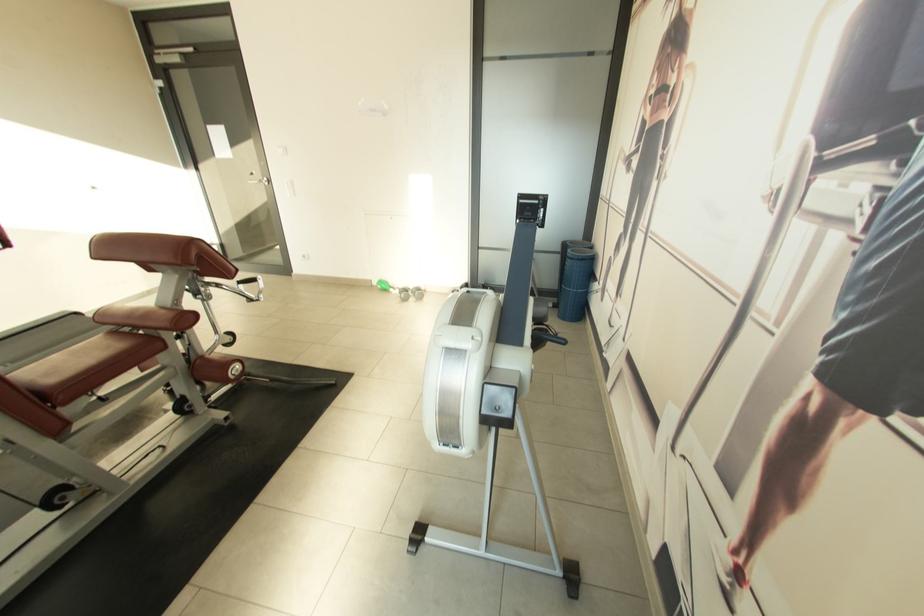
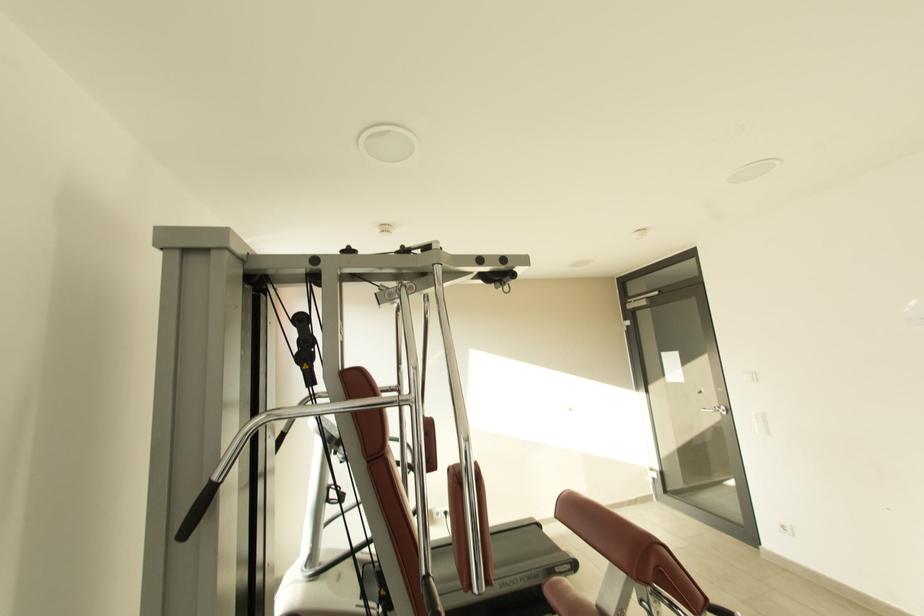
The first image is from the beginning of the video and the second image is from the end. How did the camera likely rotate when shooting the video?

The camera rotated toward left-up.